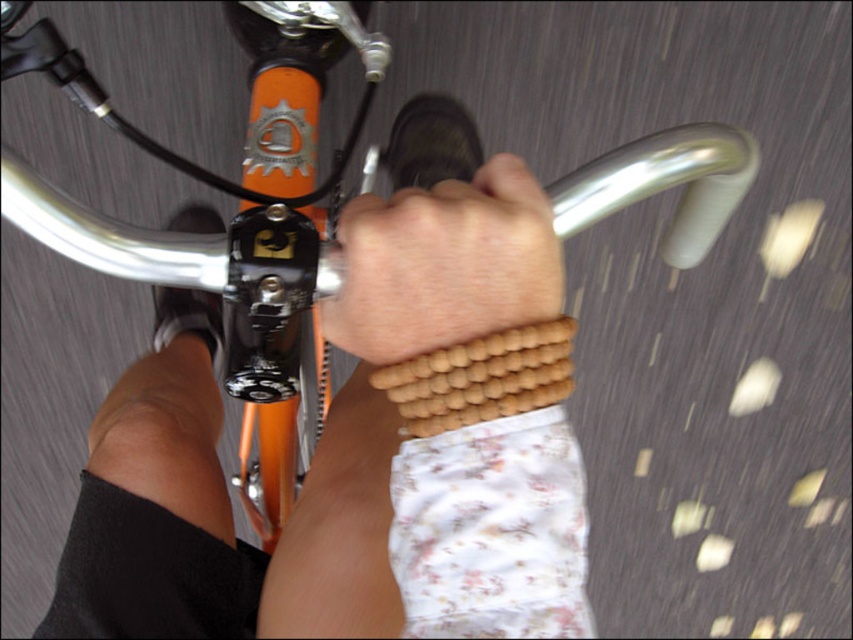
From the picture: Can you confirm if wooden beads at center is wider than brown wooden beads at center?

Indeed, wooden beads at center has a greater width compared to brown wooden beads at center.

Which is in front, point (453, 632) or point (331, 298)?

Positioned in front is point (453, 632).

Image resolution: width=853 pixels, height=640 pixels. What are the coordinates of `wooden beads at center` in the screenshot? It's located at (364, 452).